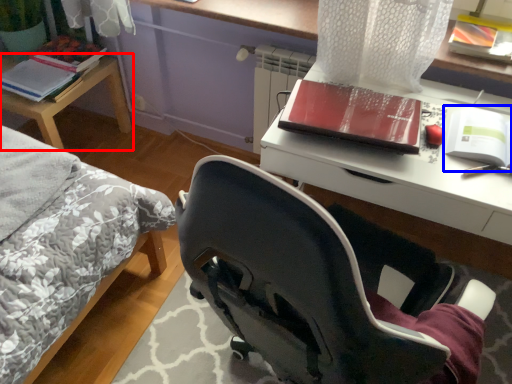
Question: Which object is closer to the camera taking this photo, table (highlighted by a red box) or paperback book (highlighted by a blue box)?

Choices:
 (A) table
 (B) paperback book

Answer: (B)